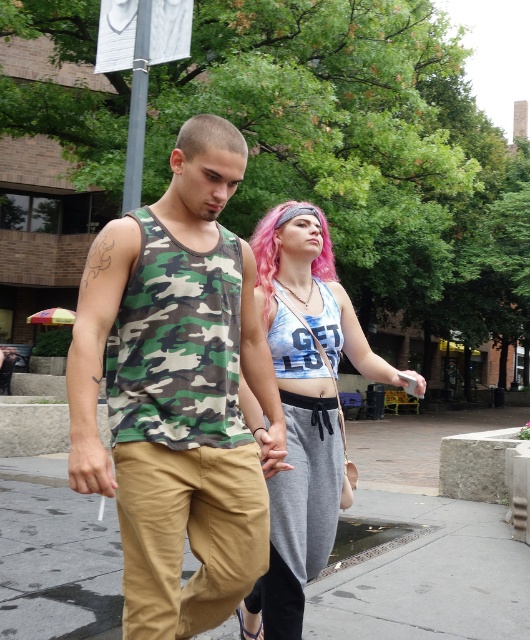
Looking at this image, who is shorter, camouflage fabric tank top at center or brown concrete pavement at lower center?

Standing shorter between the two is brown concrete pavement at lower center.

What do you see at coordinates (175, 400) in the screenshot?
I see `camouflage fabric tank top at center` at bounding box center [175, 400].

This screenshot has height=640, width=530. Identify the location of camouflage fabric tank top at center. (175, 400).

Which is more to the left, camouflage fabric tank top at center or shaved head at center?

camouflage fabric tank top at center is more to the left.

Can you confirm if camouflage fabric tank top at center is thinner than shaved head at center?

No.

Which is behind, point (224, 600) or point (242, 156)?

The point (242, 156) is behind.

At what (x,y) coordinates should I click in order to perform the action: click on camouflage fabric tank top at center. Please return your answer as a coordinate pair (x, y). Image resolution: width=530 pixels, height=640 pixels. Looking at the image, I should click on (175, 400).

How far apart are brown concrete pavement at lower center and shaved head at center?

The distance of brown concrete pavement at lower center from shaved head at center is 10.66 feet.

Based on the photo, which is above, brown concrete pavement at lower center or shaved head at center?

shaved head at center

Does point (400, 621) lie behind point (212, 122)?

Yes.

You are a GUI agent. You are given a task and a screenshot of the screen. Output one action in this format:
    pyautogui.click(x=<x>, y=<y>)
    Task: Click on the brown concrete pavement at lower center
    
    Given the screenshot: What is the action you would take?
    pyautogui.click(x=428, y=577)